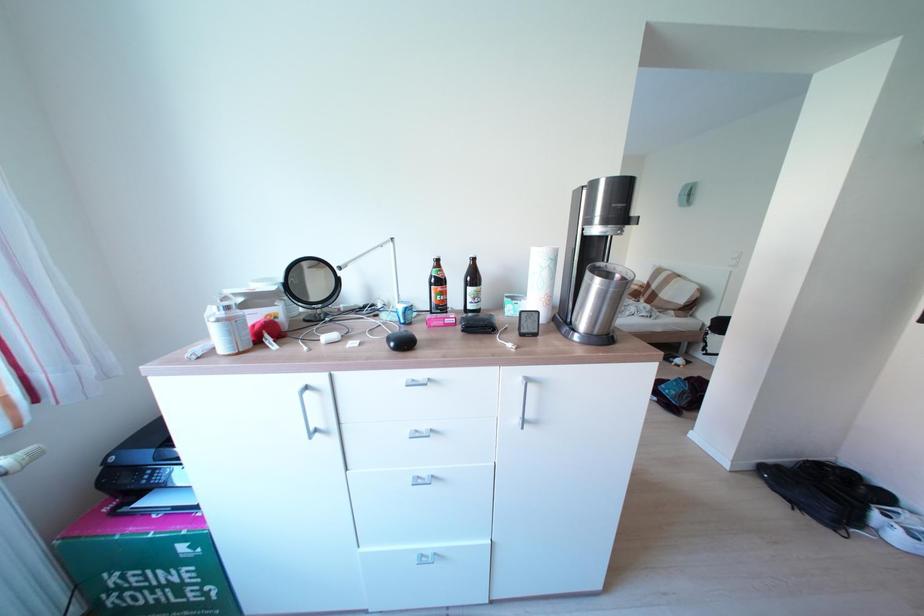
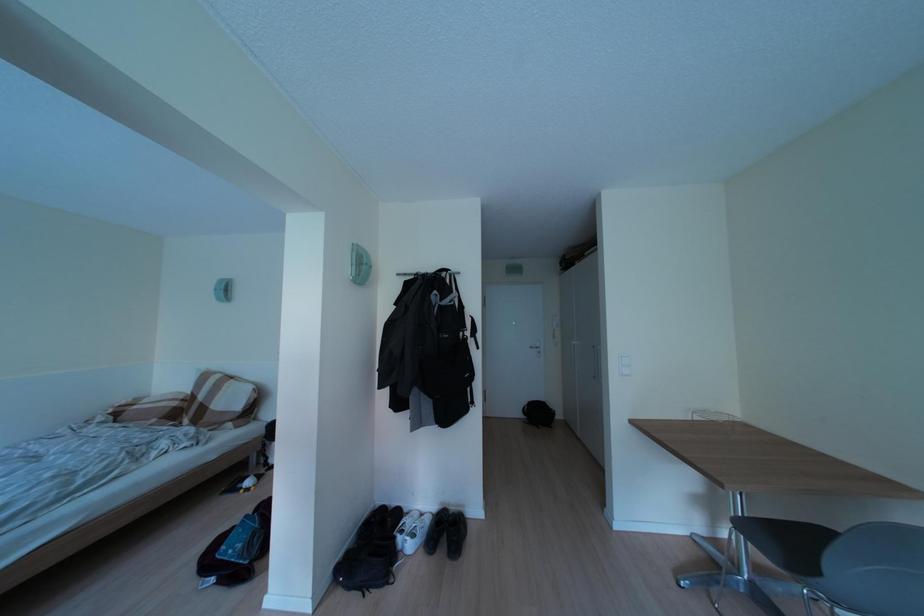
Question: The camera is either moving clockwise (left) or counter-clockwise (right) around the object. The first image is from the beginning of the video and the second image is from the end. Is the camera moving left or right when shooting the video?

Choices:
 (A) Left
 (B) Right

Answer: (A)